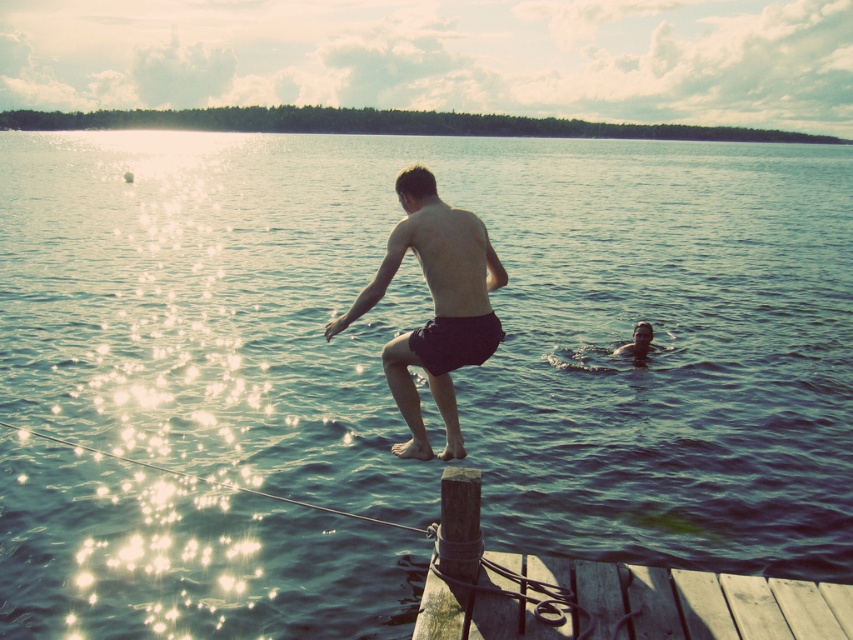
Question: Considering the real-world distances, which object is farthest from the black matte shorts at center?

Choices:
 (A) wooden planks at lower right
 (B) smooth skin boy at lower right

Answer: (B)

Question: Can you confirm if wooden planks at lower right is smaller than smooth skin boy at lower right?

Choices:
 (A) no
 (B) yes

Answer: (A)

Question: Does black matte shorts at center appear on the right side of smooth skin boy at lower right?

Choices:
 (A) yes
 (B) no

Answer: (B)

Question: Considering the real-world distances, which object is farthest from the black matte shorts at center?

Choices:
 (A) wooden planks at lower right
 (B) smooth skin boy at lower right

Answer: (B)

Question: Is wooden planks at lower right smaller than black matte shorts at center?

Choices:
 (A) no
 (B) yes

Answer: (B)

Question: Which of the following is the farthest from the observer?

Choices:
 (A) (599, 595)
 (B) (647, 348)
 (C) (379, 296)

Answer: (B)